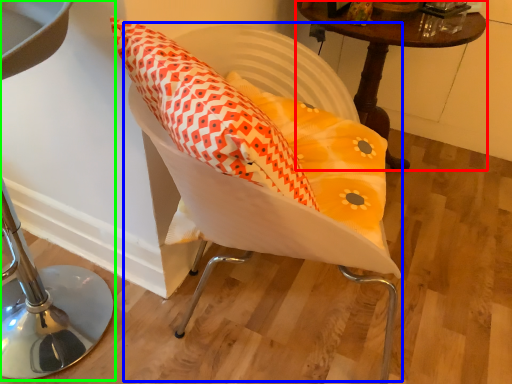
Question: Which object is the closest to the table (highlighted by a red box)? Choose among these: swivel chair (highlighted by a blue box) or furniture (highlighted by a green box).

Choices:
 (A) swivel chair
 (B) furniture

Answer: (A)